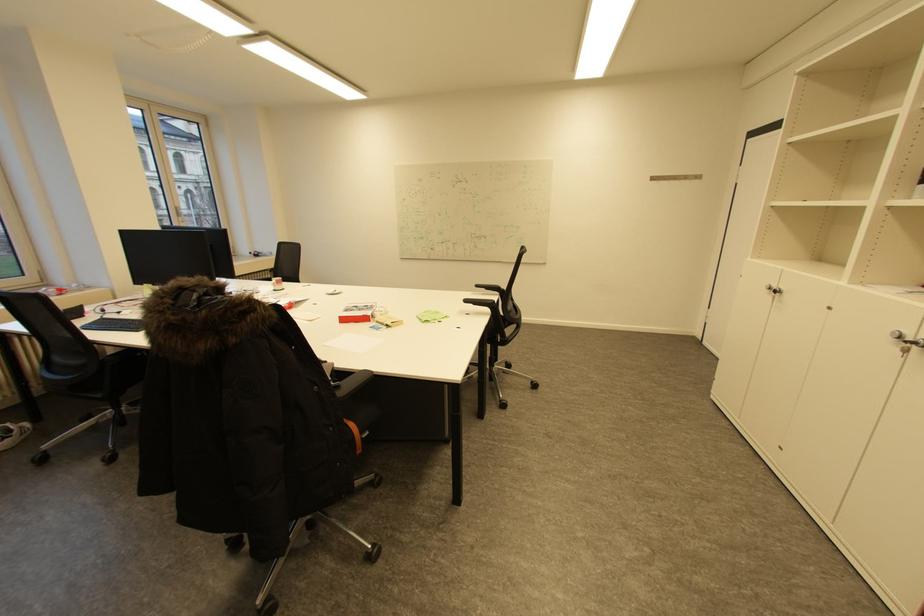
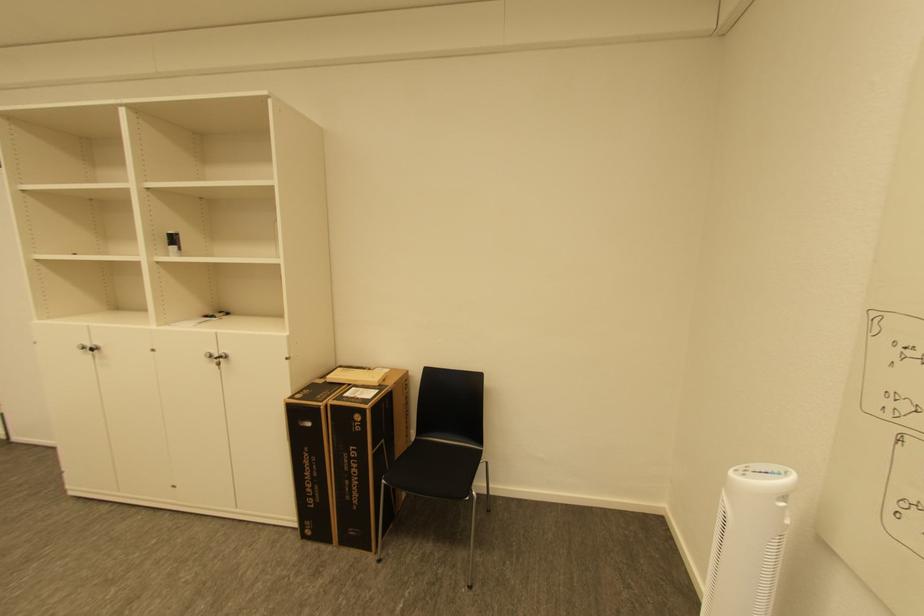
Find the pixel in the second image that matches (x=775, y=289) in the first image.

(91, 347)